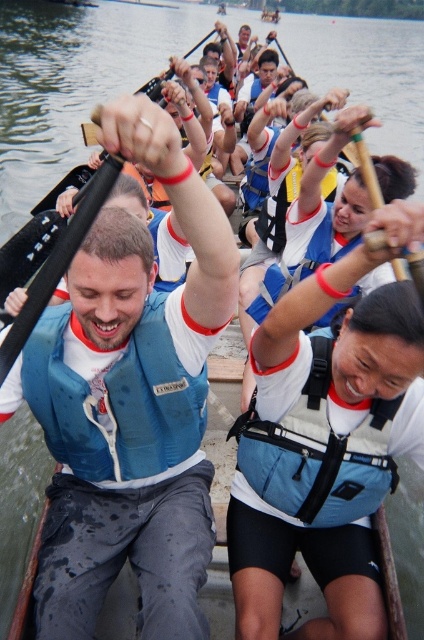
Question: Is blue life vest at center smaller than blue fabric life jacket at center?

Choices:
 (A) no
 (B) yes

Answer: (A)

Question: Is blue life vest at center closer to camera compared to blue fabric life jacket at center?

Choices:
 (A) yes
 (B) no

Answer: (A)

Question: Which of these objects is positioned closest to the blue fabric life jacket at center?

Choices:
 (A) light blue fabric life jacket at center
 (B) blue life vest at center

Answer: (B)

Question: Which point is farther to the camera?

Choices:
 (A) (169, 401)
 (B) (259, 483)
 (C) (198, 522)

Answer: (B)

Question: Among these points, which one is farthest from the camera?

Choices:
 (A) (189, 240)
 (B) (373, 481)

Answer: (B)

Question: Does blue fabric life jacket at center appear over light blue fabric life jacket at center?

Choices:
 (A) no
 (B) yes

Answer: (B)